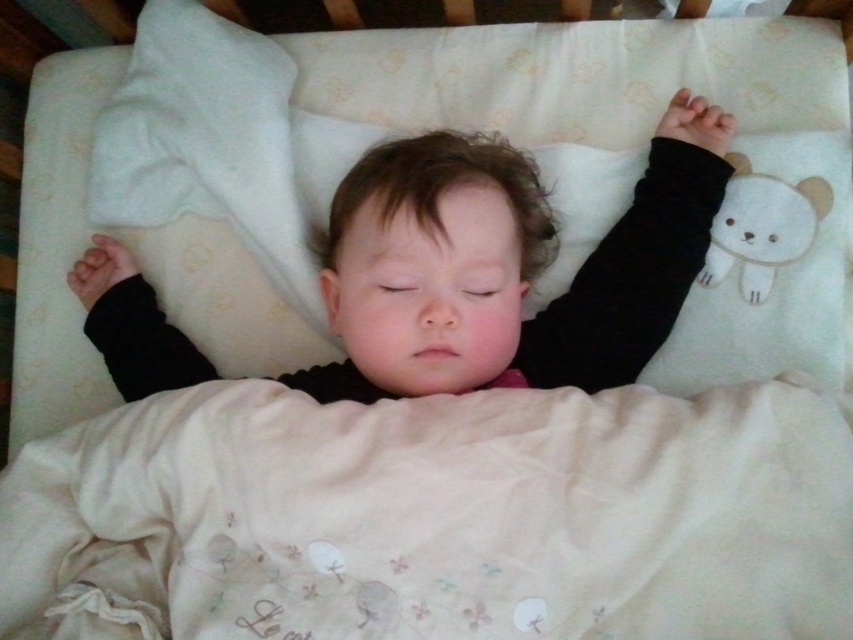
Who is more forward, (67,632) or (135,356)?

Positioned in front is point (67,632).

Between point (332, 531) and point (346, 241), which one is positioned behind?

Point (346, 241)

Identify the location of soft cream fabric at center. (434, 516).

Measure the distance from smooth skin baby at center to white plush bear at upper right.

smooth skin baby at center is 9.51 inches from white plush bear at upper right.

Is the position of smooth skin baby at center less distant than that of white plush bear at upper right?

Yes.

Who is more forward, (337, 298) or (720, 237)?

Point (337, 298) is more forward.

The width and height of the screenshot is (853, 640). Identify the location of smooth skin baby at center. (506, 266).

Is point (277, 388) more distant than point (827, 188)?

No, it is in front of (827, 188).

Measure the distance between soft cream fabric at center and white plush bear at upper right.

soft cream fabric at center is 16.56 inches away from white plush bear at upper right.

Is point (480, 547) positioned in front of point (782, 264)?

Yes.

At what (x,y) coordinates should I click in order to perform the action: click on soft cream fabric at center. Please return your answer as a coordinate pair (x, y). Looking at the image, I should click on (434, 516).